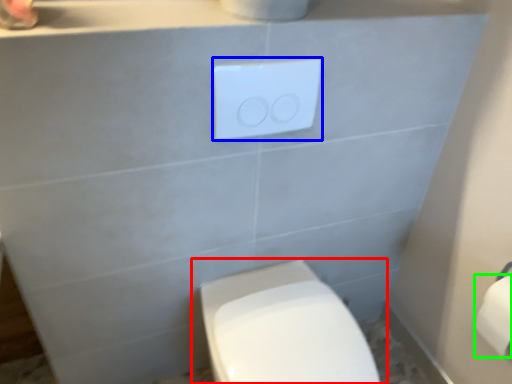
Question: Based on their relative distances, which object is farther from toilet (highlighted by a red box)? Choose from light switch (highlighted by a blue box) and toilet paper (highlighted by a green box).

Choices:
 (A) light switch
 (B) toilet paper

Answer: (A)